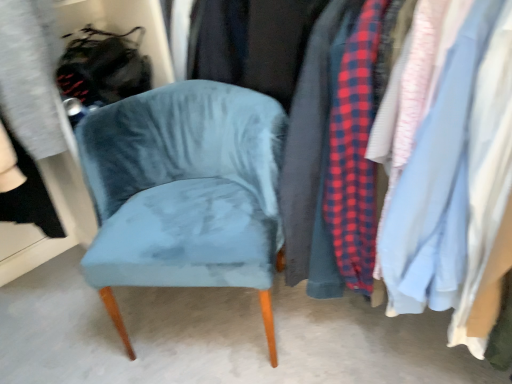
I want to click on free location to the left of velvet blue chair at center, so coord(67,320).